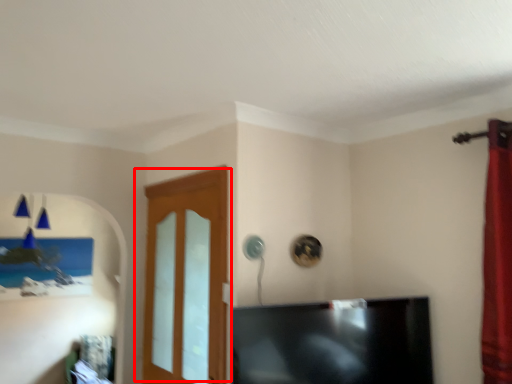
Question: From the image's perspective, what is the correct spatial relationship of door (annotated by the red box) in relation to television?

Choices:
 (A) above
 (B) below

Answer: (A)